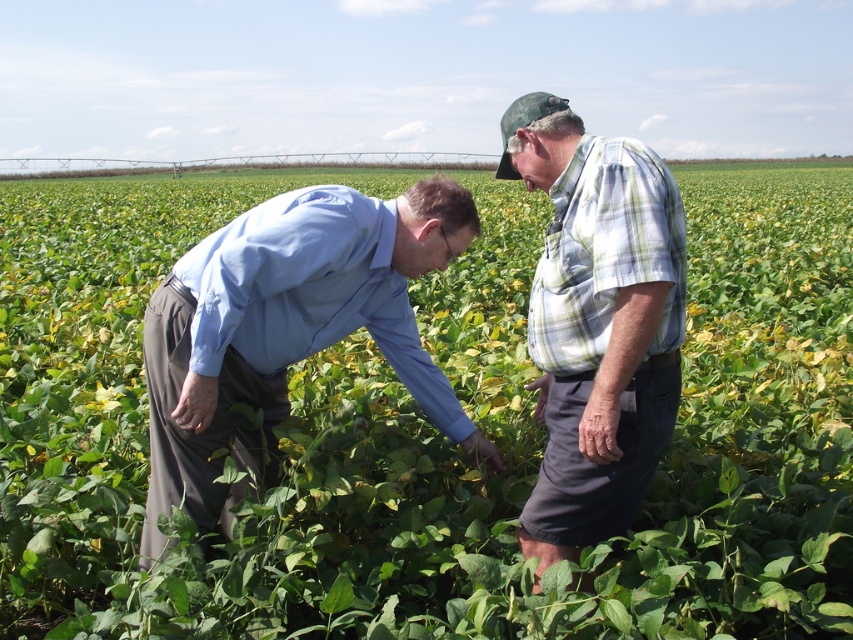
From the picture: You are a photographer taking a picture of the light blue shirt at center and the plaid shirt at center. If you want both shirts to be in focus, which one should you adjust your camera focus to prioritize?

The light blue shirt at center is shorter than the plaid shirt at center, so to ensure both are in focus, the photographer should set the focus on the light blue shirt at center since it is closer to the camera.

You are a drone operator tasked with capturing aerial footage of the soybean field. You notice two people in the field wearing a light blue shirt at center and a plaid shirt at center. Which individual should you avoid flying over to maintain a safe distance?

The light blue shirt at center is closer to the drone operator, so to maintain a safe distance, avoid flying over the light blue shirt at center.